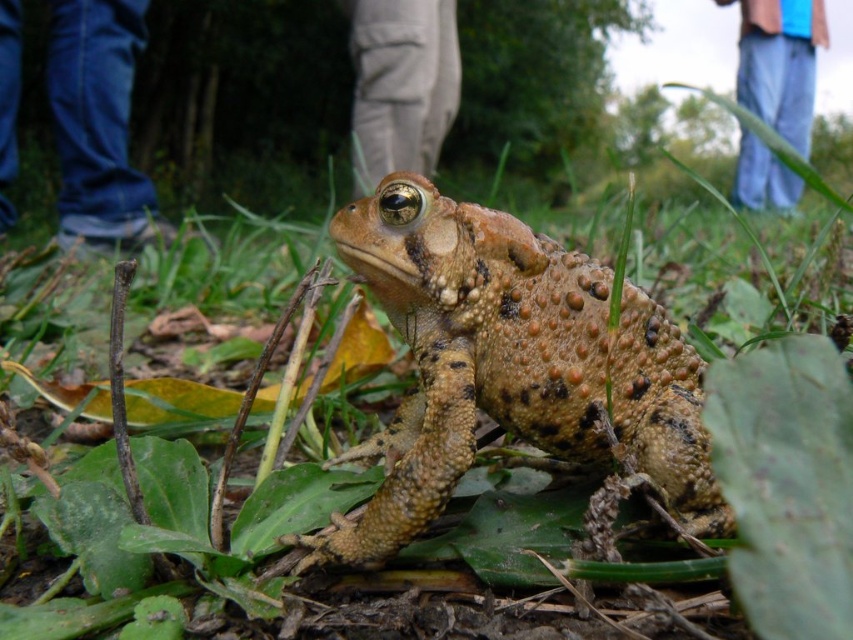
Does spotted brown skin frog at center have a lesser width compared to blue jeans at upper right?

Indeed, spotted brown skin frog at center has a lesser width compared to blue jeans at upper right.

The height and width of the screenshot is (640, 853). What do you see at coordinates (509, 364) in the screenshot? I see `spotted brown skin frog at center` at bounding box center [509, 364].

Where is `spotted brown skin frog at center`? This screenshot has height=640, width=853. spotted brown skin frog at center is located at coordinates (509, 364).

Does point (700, 440) come farther from viewer compared to point (358, 122)?

That is False.

Can you confirm if spotted brown skin frog at center is taller than khaki cotton pants at center?

No, spotted brown skin frog at center is not taller than khaki cotton pants at center.

Which is in front, point (386, 230) or point (375, 35)?

Positioned in front is point (386, 230).

The width and height of the screenshot is (853, 640). I want to click on spotted brown skin frog at center, so click(509, 364).

Does spotted brown skin frog at center lie in front of blue denim jeans at lower left?

That is True.

Is point (675, 371) less distant than point (125, 99)?

Yes, point (675, 371) is in front of point (125, 99).

What are the coordinates of `spotted brown skin frog at center` in the screenshot? It's located at (509, 364).